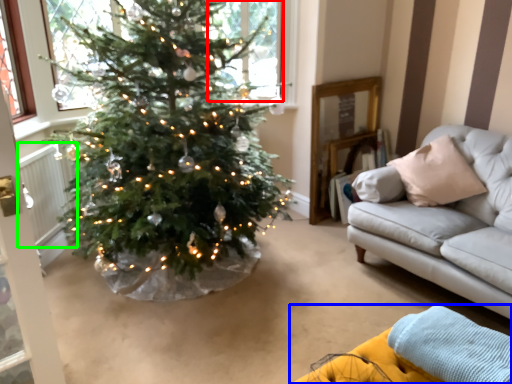
Question: Which object is positioned closest to window (highlighted by a red box)? Select from couch (highlighted by a blue box) and radiator (highlighted by a green box).

Choices:
 (A) couch
 (B) radiator

Answer: (B)